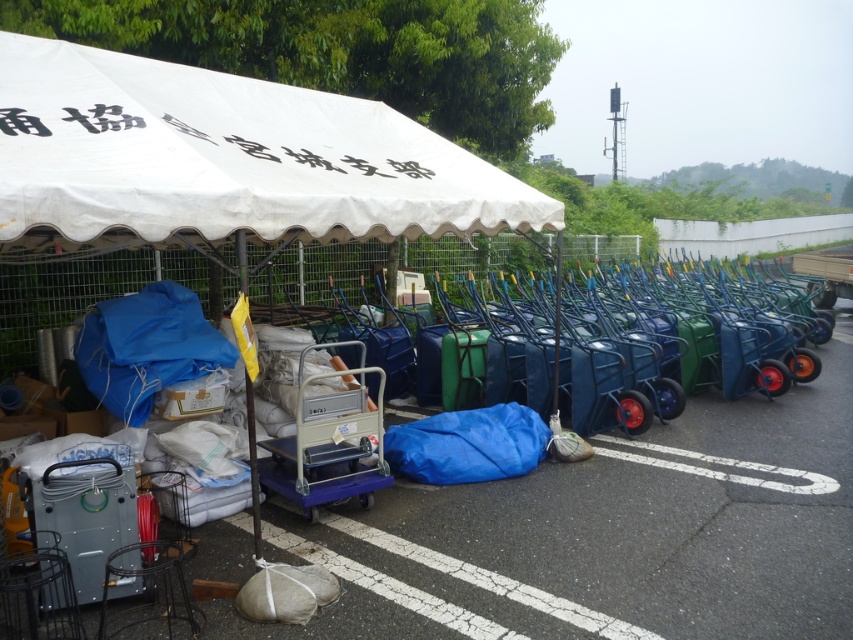
You are a delivery person who needs to unload a package that requires 2 meters of vertical clearance. You see the white fabric canopy at upper left and the metallic blue cart at center. Which object has sufficient vertical clearance for the package?

The white fabric canopy at upper left is taller than the metallic blue cart at center, so the vertical clearance under the canopy would be higher. Therefore, the white fabric canopy at upper left provides sufficient vertical clearance for the package.

You are standing in front of the canopy tent and want to take a photo of the two points mentioned. Which point, point (253, 129) or point (331, 342), will appear larger in your camera view?

Point (253, 129) will appear larger in the camera view because it is closer to the camera compared to point (331, 342).